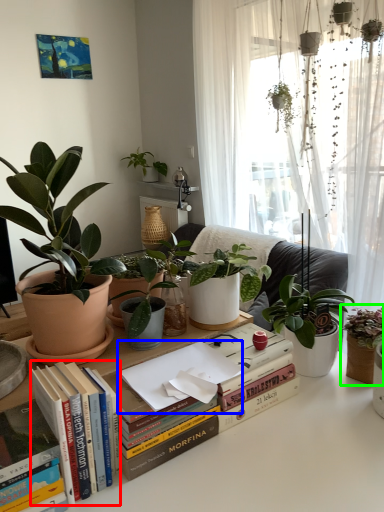
Question: Considering the real-world distances, which object is closest to book (highlighted by a red box)? paperback book (highlighted by a blue box) or houseplant (highlighted by a green box).

Choices:
 (A) paperback book
 (B) houseplant

Answer: (A)